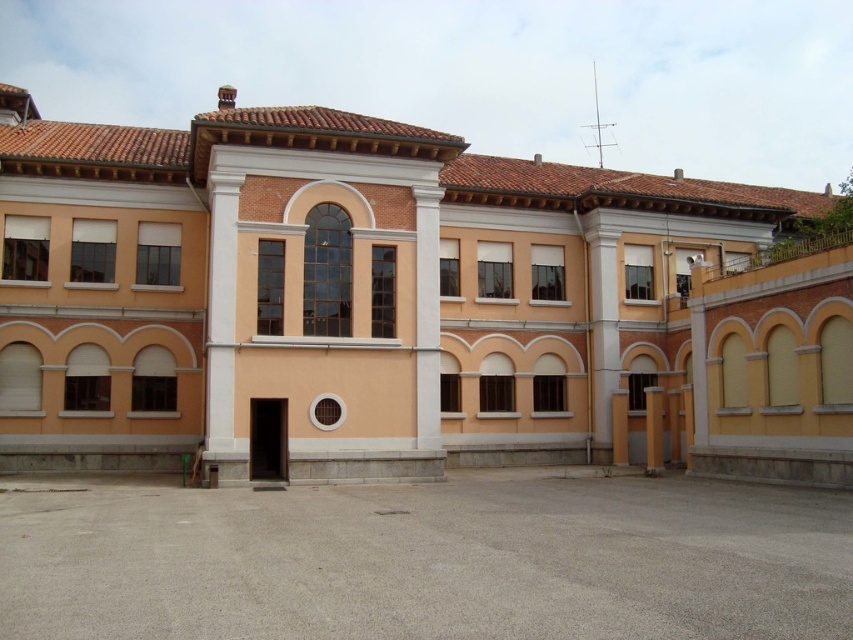
Describe the element at coordinates (653, 429) in the screenshot. I see `yellow matte pillar at lower right` at that location.

Does point (654, 406) lie behind point (625, 392)?

That is False.

Does point (653, 435) come in front of point (618, 388)?

Yes, point (653, 435) is closer to viewer.

Locate an element on the screen. Image resolution: width=853 pixels, height=640 pixels. yellow matte pillar at lower right is located at coordinates (653, 429).